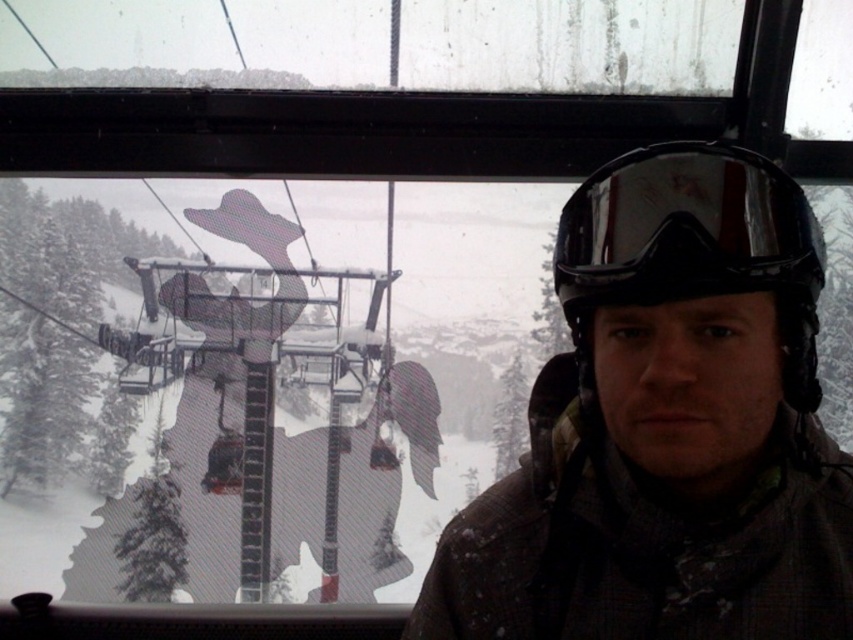
Question: Which of the following is the farthest from the observer?

Choices:
 (A) (547, 486)
 (B) (683, 168)
 (C) (663, 172)

Answer: (A)

Question: Can you confirm if camouflage jacket at center is wider than black matte helmet at center?

Choices:
 (A) yes
 (B) no

Answer: (A)

Question: Which point is closer to the camera?

Choices:
 (A) camouflage jacket at center
 (B) black matte helmet at center
 (C) black reflective goggles at center

Answer: (B)

Question: Is camouflage jacket at center positioned at the back of black reflective goggles at center?

Choices:
 (A) no
 (B) yes

Answer: (B)

Question: Which point is farther to the camera?

Choices:
 (A) black matte helmet at center
 (B) camouflage jacket at center

Answer: (B)

Question: Considering the relative positions of camouflage jacket at center and black matte helmet at center in the image provided, where is camouflage jacket at center located with respect to black matte helmet at center?

Choices:
 (A) left
 (B) right

Answer: (A)